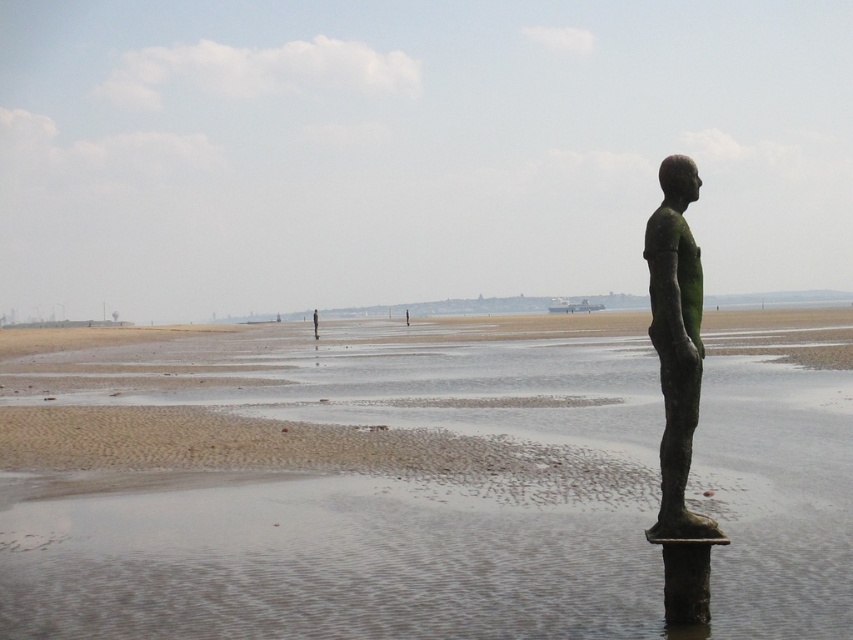
Question: Can you confirm if sandy brown beach at center is positioned to the left of green patina bronze statue at right?

Choices:
 (A) no
 (B) yes

Answer: (B)

Question: Where is sandy brown beach at center located in relation to green patina bronze statue at right in the image?

Choices:
 (A) below
 (B) above

Answer: (A)

Question: Which point appears farthest from the camera in this image?

Choices:
 (A) (686, 198)
 (B) (479, 417)

Answer: (B)

Question: Which point appears closest to the camera in this image?

Choices:
 (A) (660, 609)
 (B) (685, 225)

Answer: (B)

Question: Is sandy brown beach at center above green patina bronze statue at right?

Choices:
 (A) no
 (B) yes

Answer: (A)